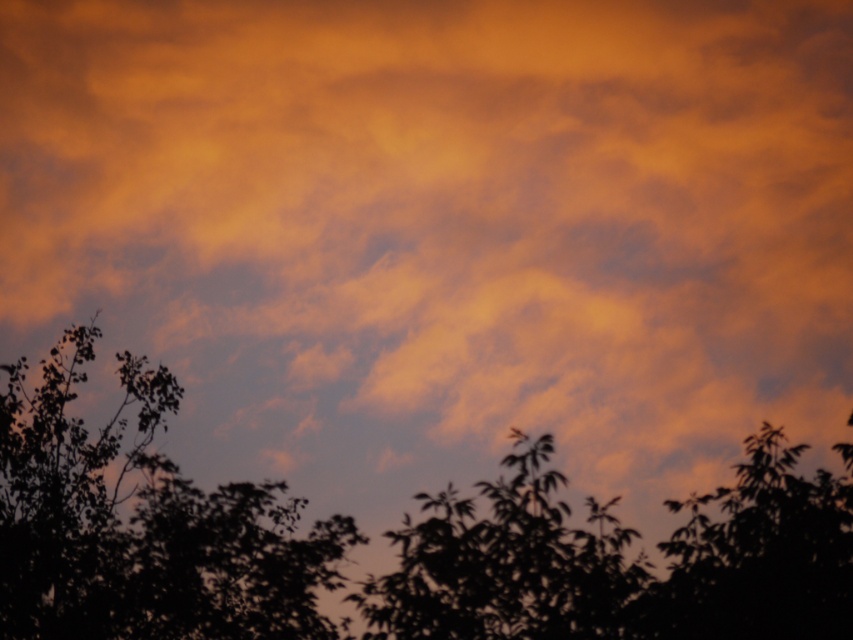
Question: Which point is closer to the camera?

Choices:
 (A) silhouette leafy tree at center
 (B) silhouette leafy tree at lower center
 (C) silhouette leafy tree at lower right

Answer: (C)

Question: Observing the image, what is the correct spatial positioning of silhouette leafy tree at lower left in reference to silhouette leafy tree at center?

Choices:
 (A) below
 (B) above

Answer: (B)

Question: Is silhouette leafy tree at lower center to the left of silhouette leafy tree at lower left from the viewer's perspective?

Choices:
 (A) no
 (B) yes

Answer: (B)

Question: Which point is farther to the camera?

Choices:
 (A) (189, 490)
 (B) (653, 600)
 (C) (4, 502)

Answer: (C)

Question: Which of these objects is positioned closest to the silhouette leafy tree at lower right?

Choices:
 (A) silhouette leafy tree at lower left
 (B) silhouette leafy tree at center
 (C) silhouette leafy tree at lower center

Answer: (B)

Question: Is silhouette leafy tree at lower left positioned in front of silhouette leafy tree at center?

Choices:
 (A) yes
 (B) no

Answer: (B)